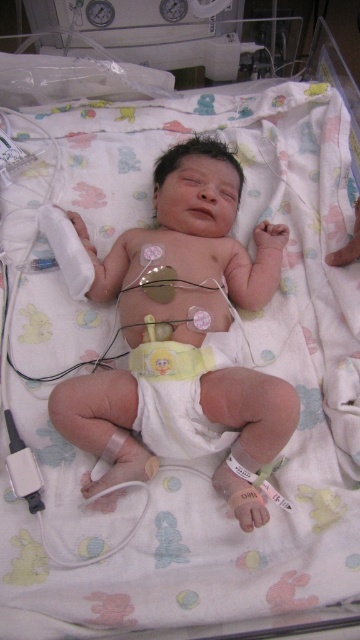
Does smooth white diaper at center have a smaller size compared to teething ring at center?

No.

Does point (145, 454) come farther from viewer compared to point (354, 209)?

No, it is in front of (354, 209).

The height and width of the screenshot is (640, 360). What are the coordinates of `smooth white diaper at center` in the screenshot? It's located at (183, 339).

Looking at this image, does smooth white diaper at center appear under white soft diaper at center?

No.

Find the location of a particular element. The image size is (360, 640). smooth white diaper at center is located at coordinates (183, 339).

Which is in front, point (84, 444) or point (185, 348)?

Point (84, 444)

You are a GUI agent. You are given a task and a screenshot of the screen. Output one action in this format:
    pyautogui.click(x=<x>, y=<y>)
    Task: Click on the smooth white diaper at center
    The width and height of the screenshot is (360, 640).
    Given the screenshot: What is the action you would take?
    pyautogui.click(x=183, y=339)

Describe the element at coordinates (176, 397) in the screenshot. The width and height of the screenshot is (360, 640). I see `white soft diaper at center` at that location.

Based on the photo, between white soft diaper at center and teething ring at center, which one has less height?

teething ring at center

Does point (149, 396) come farther from viewer compared to point (353, 205)?

No, (149, 396) is in front of (353, 205).

In order to click on white soft diaper at center in this screenshot , I will do `click(176, 397)`.